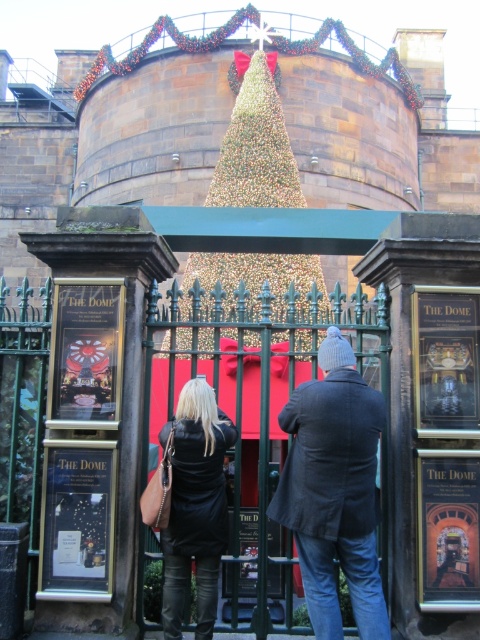
Question: Based on their relative distances, which object is nearer to the gold glittering tree at center?

Choices:
 (A) dark gray woolen coat at center
 (B) black leather jacket at center

Answer: (B)

Question: Which object appears closest to the camera in this image?

Choices:
 (A) dark gray woolen coat at center
 (B) gold glittering tree at center
 (C) black leather jacket at center

Answer: (A)

Question: In this image, where is dark gray woolen coat at center located relative to black leather jacket at center?

Choices:
 (A) above
 (B) below

Answer: (B)

Question: From the image, what is the correct spatial relationship of dark gray woolen coat at center in relation to gold glittering tree at center?

Choices:
 (A) left
 (B) right

Answer: (B)

Question: Is gold glittering tree at center to the right of black leather jacket at center from the viewer's perspective?

Choices:
 (A) no
 (B) yes

Answer: (B)

Question: Which of these objects is positioned farthest from the gold glittering tree at center?

Choices:
 (A) black leather jacket at center
 (B) dark gray woolen coat at center

Answer: (B)